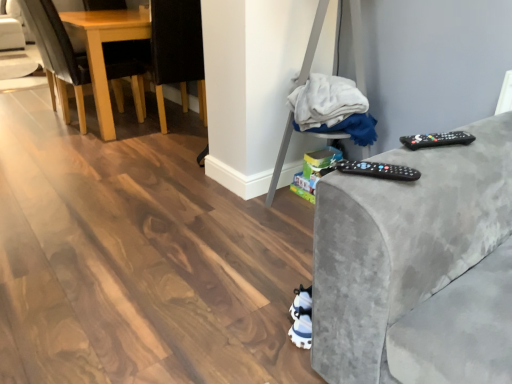
Question: Is white fabric at center not near black plastic remote at right, arranged as the second remote when ordered from the bottom?

Choices:
 (A) no
 (B) yes

Answer: (A)

Question: Does white fabric at center have a lesser height compared to black plastic remote at right, arranged as the second remote when ordered from the bottom?

Choices:
 (A) no
 (B) yes

Answer: (A)

Question: From a real-world perspective, is white fabric at center under black plastic remote at right, acting as the 1th remote starting from the right?

Choices:
 (A) no
 (B) yes

Answer: (B)

Question: Can we say white fabric at center lies outside black plastic remote at right, which is the first remote from back to front?

Choices:
 (A) yes
 (B) no

Answer: (A)

Question: Is white fabric at center to the right of black plastic remote at right, which appears as the 1th remote when viewed from the top, from the viewer's perspective?

Choices:
 (A) no
 (B) yes

Answer: (A)

Question: Can you confirm if white fabric at center is smaller than black plastic remote at right, the second remote in the left-to-right sequence?

Choices:
 (A) yes
 (B) no

Answer: (B)

Question: From a real-world perspective, is white fabric at center over black fabric chair at left, which is the 1th chair in right-to-left order?

Choices:
 (A) yes
 (B) no

Answer: (A)

Question: From the image's perspective, is white fabric at center located above black fabric chair at left, which is the 1th chair in right-to-left order?

Choices:
 (A) yes
 (B) no

Answer: (B)

Question: Considering the relative sizes of white fabric at center and black fabric chair at left, which is the 1th chair in right-to-left order, in the image provided, is white fabric at center shorter than black fabric chair at left, which is the 1th chair in right-to-left order,?

Choices:
 (A) no
 (B) yes

Answer: (B)

Question: Is white fabric at center far from black fabric chair at left, which is counted as the 2th chair, starting from the left?

Choices:
 (A) no
 (B) yes

Answer: (B)

Question: Is white fabric at center aimed at black fabric chair at left, which is counted as the 2th chair, starting from the left?

Choices:
 (A) yes
 (B) no

Answer: (B)

Question: Is black fabric chair at left, which is counted as the 2th chair, starting from the left, located within white fabric at center?

Choices:
 (A) no
 (B) yes

Answer: (A)

Question: Is black fabric chair at left, which is counted as the 2th chair, starting from the left, smaller than black plastic remote at right, which is the first remote from back to front?

Choices:
 (A) yes
 (B) no

Answer: (B)